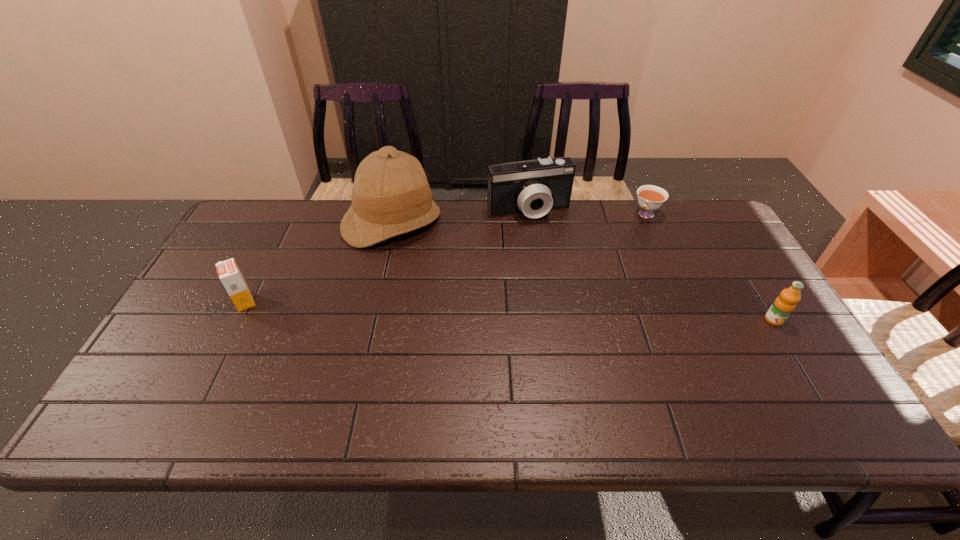
This screenshot has width=960, height=540. I want to click on free space on the desktop that is between the farther orange juice and the nearer orange juice and is positioned on the side of the shortest object with the handle, so click(570, 313).

This screenshot has width=960, height=540. I want to click on vacant spot on the desktop that is between the leftmost object and the right orange juice and is positioned on the lens of the camcorder, so click(578, 313).

Locate an element on the screen. free space on the desktop that is between the leftmost object and the nearest object and is positioned on the front-facing side of the hat is located at coordinates (x=444, y=308).